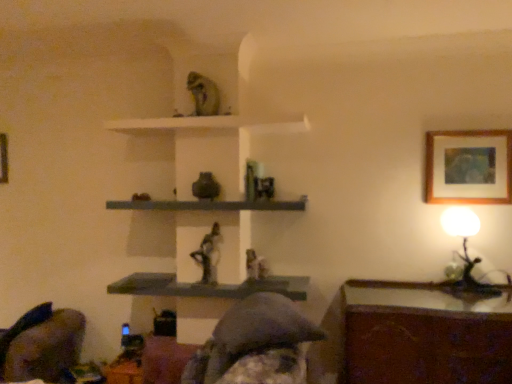
Question: From the image's perspective, would you say matte gray statue at center, the 3th person when ordered from back to front, is shown under matte gray shelf at center, the 3th shelf when ordered from top to bottom?

Choices:
 (A) yes
 (B) no

Answer: (B)

Question: Is matte gray statue at center, the 3th person when ordered from back to front, to the right of matte gray shelf at center, the 3th shelf when ordered from top to bottom, from the viewer's perspective?

Choices:
 (A) yes
 (B) no

Answer: (A)

Question: Can you confirm if matte gray statue at center, positioned as the first person in front-to-back order, is thinner than matte gray shelf at center, positioned as the first shelf in bottom-to-top order?

Choices:
 (A) yes
 (B) no

Answer: (B)

Question: From a real-world perspective, is matte gray statue at center, the 3th person when ordered from back to front, located beneath matte gray shelf at center, positioned as the first shelf in bottom-to-top order?

Choices:
 (A) no
 (B) yes

Answer: (A)

Question: From the image's perspective, does matte gray statue at center, the 3th person when ordered from back to front, appear higher than matte gray shelf at center, positioned as the first shelf in bottom-to-top order?

Choices:
 (A) yes
 (B) no

Answer: (A)

Question: Considering the relative positions of wooden framed artwork at upper right, which ranks as the second picture frame in left-to-right order, and white matte shelf at upper center, arranged as the 1th shelf when viewed from the top, in the image provided, is wooden framed artwork at upper right, which ranks as the second picture frame in left-to-right order, to the left or to the right of white matte shelf at upper center, arranged as the 1th shelf when viewed from the top,?

Choices:
 (A) right
 (B) left

Answer: (A)

Question: From a real-world perspective, is wooden framed artwork at upper right, positioned as the 1th picture frame in front-to-back order, physically located above or below white matte shelf at upper center, marked as the 3th shelf in a bottom-to-top arrangement?

Choices:
 (A) below
 (B) above

Answer: (A)

Question: Does point [468, 163] appear closer or farther from the camera than point [178, 117]?

Choices:
 (A) farther
 (B) closer

Answer: (A)

Question: In terms of size, does wooden framed artwork at upper right, the first picture frame from the right, appear bigger or smaller than white matte shelf at upper center, marked as the 3th shelf in a bottom-to-top arrangement?

Choices:
 (A) big
 (B) small

Answer: (B)

Question: In the image, is matte gray statue at center, the 3th person when ordered from back to front, positioned in front of or behind matte gray statue at center, placed as the first person when sorted from back to front?

Choices:
 (A) front
 (B) behind

Answer: (A)

Question: From the image's perspective, is matte gray statue at center, the 3th person when ordered from back to front, positioned above or below matte gray statue at center, placed as the first person when sorted from back to front?

Choices:
 (A) below
 (B) above

Answer: (A)

Question: Considering the positions of matte gray statue at center, positioned as the first person in front-to-back order, and matte gray statue at center, placed as the first person when sorted from back to front, in the image, is matte gray statue at center, positioned as the first person in front-to-back order, wider or thinner than matte gray statue at center, placed as the first person when sorted from back to front,?

Choices:
 (A) wide
 (B) thin

Answer: (A)

Question: Considering the positions of point (259, 382) and point (261, 268), is point (259, 382) closer or farther from the camera than point (261, 268)?

Choices:
 (A) farther
 (B) closer

Answer: (B)

Question: Visually, is wooden framed artwork at upper right, positioned as the 1th picture frame in front-to-back order, positioned to the left or to the right of white glossy table lamp at right?

Choices:
 (A) right
 (B) left

Answer: (A)

Question: Does point (430, 173) appear closer or farther from the camera than point (479, 225)?

Choices:
 (A) farther
 (B) closer

Answer: (A)